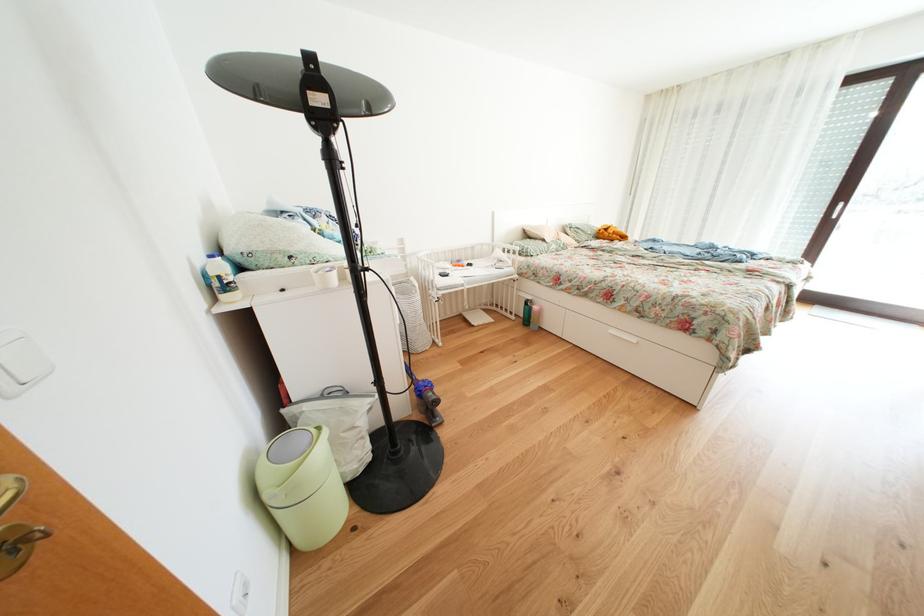
Where is `white drawer knob`? white drawer knob is located at coordinates (624, 336).